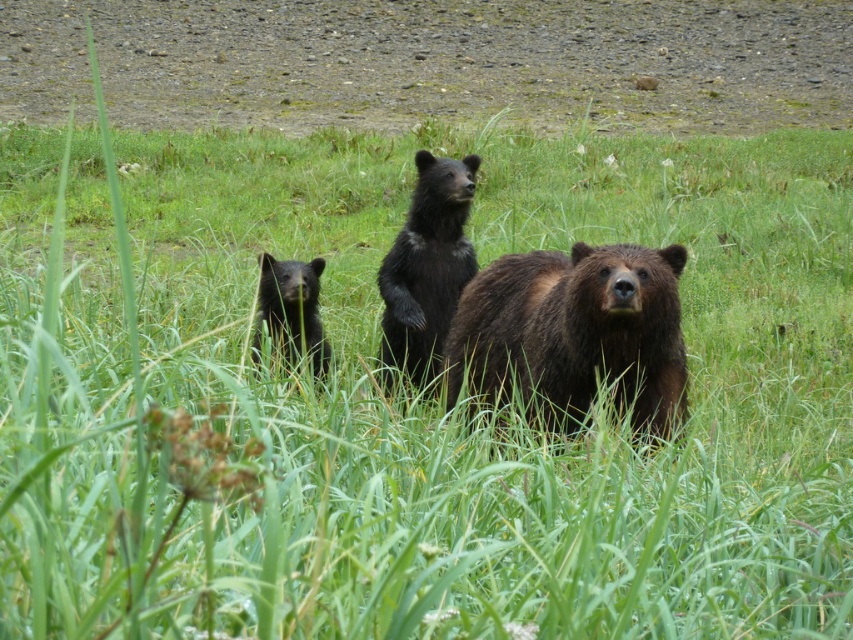
You are a wildlife photographer aiming to capture a photo of both the brown furry bear at center and the black fuzzy bear cub at center. Based on their positions, which bear should you focus on first to ensure both are in frame?

The brown furry bear at center is located above the black fuzzy bear cub at center, so you should focus on the brown furry bear at center first to ensure both are in frame.

You are a wildlife photographer aiming to capture a photo of both the black fur bear at center and the black fuzzy bear cub at center. Since you want them both in the frame, can you tell me which bear is on the left side so you can position your camera accordingly?

The black fuzzy bear cub at center is on the left side of the black fur bear at center, so you should position your camera to include both the black fuzzy bear cub at center on the left and the black fur bear at center on the right.

You are standing at the origin point in the image and want to reach the largest bear. There are two points marked as point (416, 324) and point (328, 369). Which point should you go through first to reach the largest bear efficiently?

You should go through point (328, 369) first because it is in front of point (416, 324), which is behind it. Since the largest bear is further back, you need to pass through the closer point first before moving to the one behind.